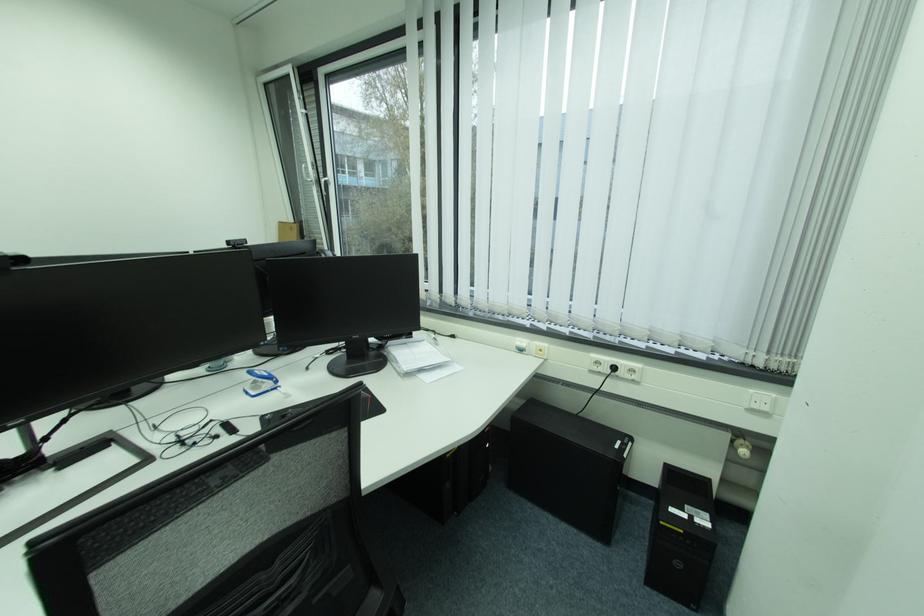
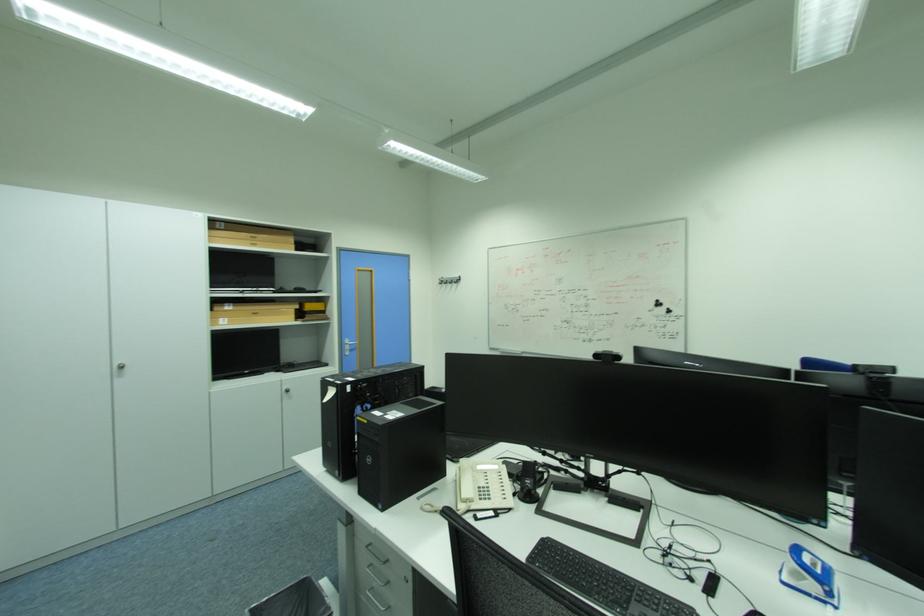
Question: The camera is either moving clockwise (left) or counter-clockwise (right) around the object. The first image is from the beginning of the video and the second image is from the end. Is the camera moving left or right when shooting the video?

Choices:
 (A) Left
 (B) Right

Answer: (B)